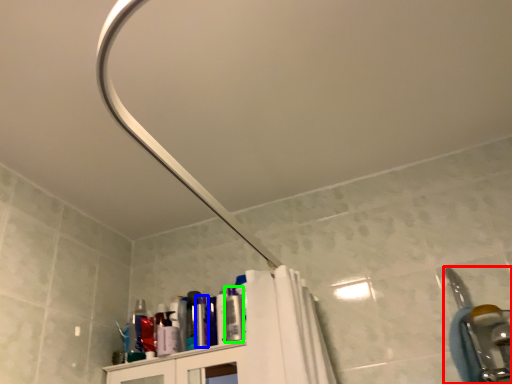
Question: Which is farther away from plumbing fixture (highlighted by a red box)? toiletry (highlighted by a blue box) or toiletry (highlighted by a green box)?

Choices:
 (A) toiletry
 (B) toiletry

Answer: (A)